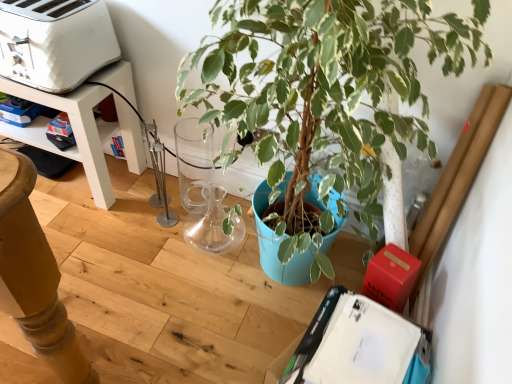
Question: From the image's perspective, relative to green variegated leaf at center, is white plastic toaster at upper left above or below?

Choices:
 (A) below
 (B) above

Answer: (B)

Question: Is white plastic toaster at upper left inside or outside of green variegated leaf at center?

Choices:
 (A) inside
 (B) outside

Answer: (B)

Question: Visually, is white plastic toaster at upper left positioned to the left or to the right of green variegated leaf at center?

Choices:
 (A) left
 (B) right

Answer: (A)

Question: Is green variegated leaf at center taller or shorter than white plastic toaster at upper left?

Choices:
 (A) tall
 (B) short

Answer: (A)

Question: Is green variegated leaf at center in front of or behind white plastic toaster at upper left in the image?

Choices:
 (A) front
 (B) behind

Answer: (A)

Question: In terms of width, does green variegated leaf at center look wider or thinner when compared to white plastic toaster at upper left?

Choices:
 (A) thin
 (B) wide

Answer: (B)

Question: From the image's perspective, is green variegated leaf at center above or below white plastic toaster at upper left?

Choices:
 (A) below
 (B) above

Answer: (A)